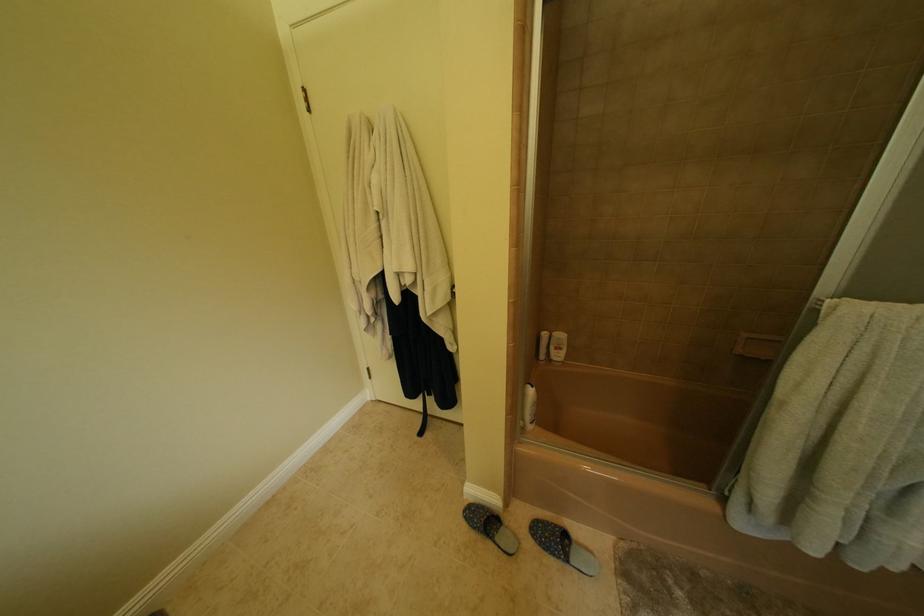
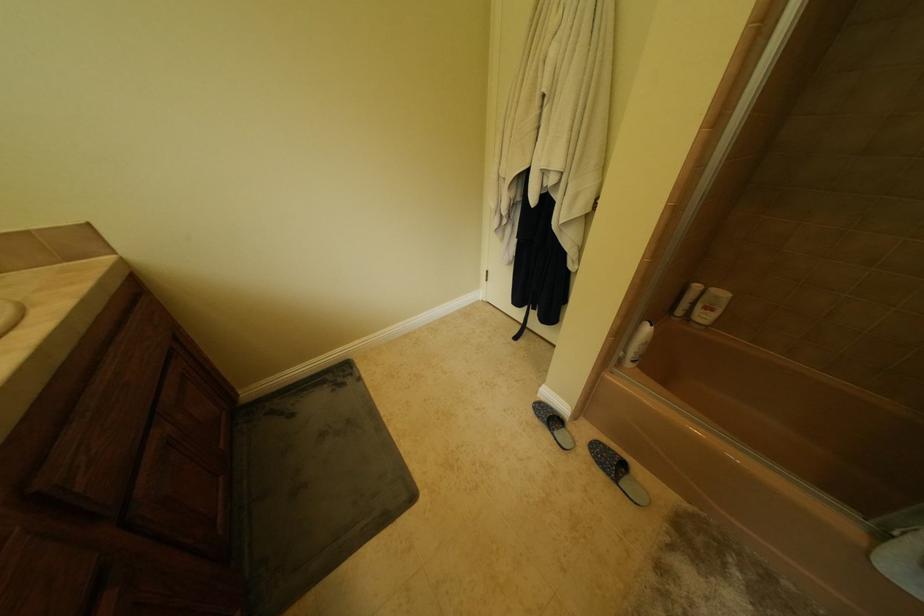
The images are taken continuously from a first-person perspective. In which direction is your viewpoint rotating?

The camera rotated toward left-down.